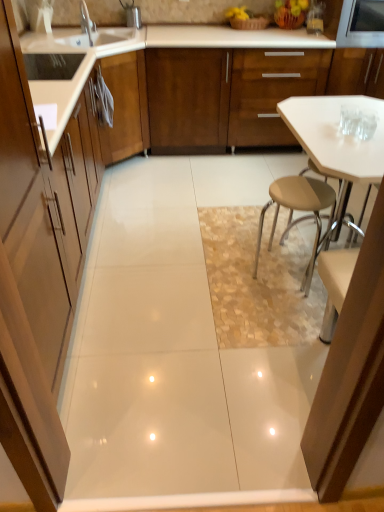
Question: Is silver metallic faucet at upper left positioned behind matte wood cabinet at left, which is counted as the first cabinetry, starting from the bottom?

Choices:
 (A) yes
 (B) no

Answer: (A)

Question: From a real-world perspective, is silver metallic faucet at upper left positioned over matte wood cabinet at left, which ranks as the 1th cabinetry in left-to-right order, based on gravity?

Choices:
 (A) yes
 (B) no

Answer: (A)

Question: Is silver metallic faucet at upper left closer to the viewer compared to matte wood cabinet at left, which ranks as the 1th cabinetry in left-to-right order?

Choices:
 (A) no
 (B) yes

Answer: (A)

Question: Does silver metallic faucet at upper left have a lesser height compared to matte wood cabinet at left, which is counted as the second cabinetry, starting from the right?

Choices:
 (A) yes
 (B) no

Answer: (A)

Question: Considering the relative sizes of silver metallic faucet at upper left and matte wood cabinet at left, which is counted as the first cabinetry, starting from the bottom, in the image provided, is silver metallic faucet at upper left thinner than matte wood cabinet at left, which is counted as the first cabinetry, starting from the bottom,?

Choices:
 (A) no
 (B) yes

Answer: (B)

Question: Considering the relative positions of white glossy table at center and matte wood cabinet at left, which ranks as the 1th cabinetry in left-to-right order, in the image provided, is white glossy table at center to the left or to the right of matte wood cabinet at left, which ranks as the 1th cabinetry in left-to-right order,?

Choices:
 (A) left
 (B) right

Answer: (B)

Question: Considering their positions, is white glossy table at center located in front of or behind matte wood cabinet at left, placed as the second cabinetry when sorted from back to front?

Choices:
 (A) front
 (B) behind

Answer: (B)

Question: From a real-world perspective, is white glossy table at center physically located above or below matte wood cabinet at left, the first cabinetry when ordered from front to back?

Choices:
 (A) above
 (B) below

Answer: (B)

Question: Is white glossy table at center situated inside matte wood cabinet at left, which ranks as the 2th cabinetry in top-to-bottom order, or outside?

Choices:
 (A) outside
 (B) inside

Answer: (A)

Question: Based on their sizes in the image, would you say matte wood cabinet at left, the first cabinetry when ordered from front to back, is bigger or smaller than white glossy table at center?

Choices:
 (A) small
 (B) big

Answer: (A)

Question: Is matte wood cabinet at left, which is counted as the second cabinetry, starting from the right, taller or shorter than white glossy table at center?

Choices:
 (A) tall
 (B) short

Answer: (A)

Question: From a real-world perspective, relative to white glossy table at center, is matte wood cabinet at left, which ranks as the 1th cabinetry in left-to-right order, vertically above or below?

Choices:
 (A) below
 (B) above

Answer: (B)

Question: Is point (3, 54) positioned closer to the camera than point (347, 172)?

Choices:
 (A) farther
 (B) closer

Answer: (B)

Question: Is metallic stainless steel microwave at upper right in front of or behind matte wood cabinet at left, placed as the second cabinetry when sorted from back to front, in the image?

Choices:
 (A) front
 (B) behind

Answer: (B)

Question: Is metallic stainless steel microwave at upper right inside the boundaries of matte wood cabinet at left, the first cabinetry when ordered from front to back, or outside?

Choices:
 (A) inside
 (B) outside

Answer: (B)